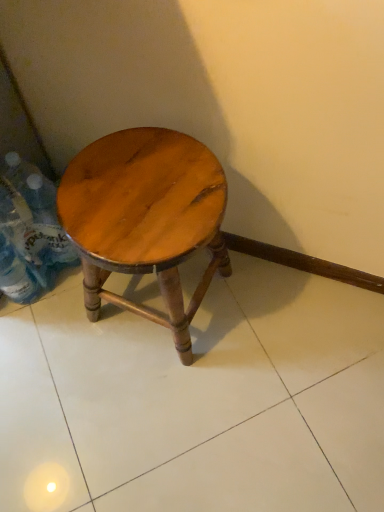
Where is `free space to the left of wooden stool at center`? free space to the left of wooden stool at center is located at coordinates (55, 336).